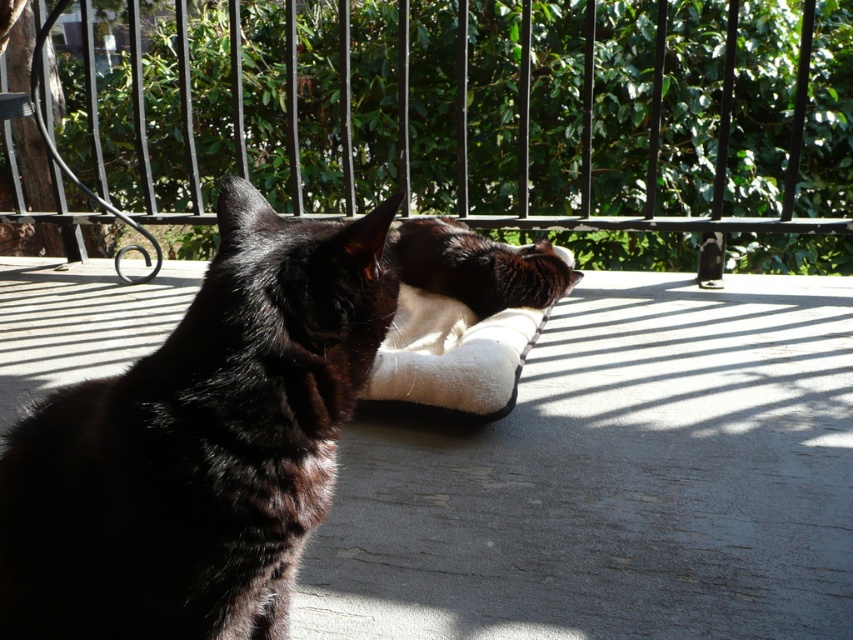
You are a cat owner who wants to ensure your cats are comfortable. You see the black fur cat at center and the black soft cushion at center. Which object is supporting the other?

The black soft cushion at center is positioned under the black fur cat at center, so it is supporting the cat.

You are standing on the balcony and want to pet the black fur cat at center. Which direction should you move to approach it from the black metal fence at upper center?

You should move to the right from the black metal fence at upper center to approach the black fur cat at center because the black metal fence at upper center is located to the left of the black fur cat at center.

You are a small bird flying over the balcony. You want to land on the black soft cushion at center but need to avoid hitting the black metal fence at upper center. Considering their heights, can you safely descend to the cushion without hitting the fence?

The black metal fence at upper center is taller than the black soft cushion at center, so you can safely descend to the cushion without hitting the fence as long as you aim below the fence.